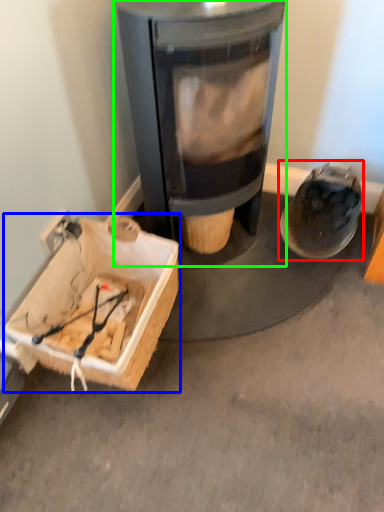
Question: Estimate the real-world distances between objects in this image. Which object is closer to footwear (highlighted by a red box), cardboard box (highlighted by a blue box) or wood burning stove (highlighted by a green box)?

Choices:
 (A) cardboard box
 (B) wood burning stove

Answer: (B)